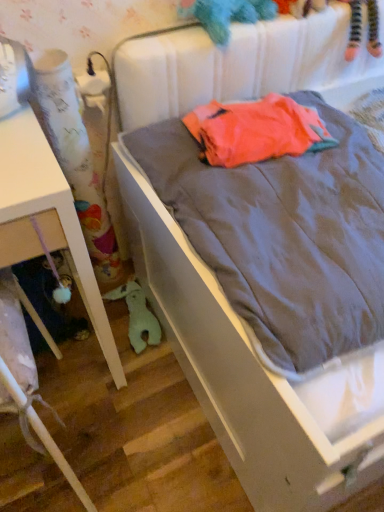
Question: From a real-world perspective, relative to white fabric curtain at left, is matte gray bed at center vertically above or below?

Choices:
 (A) above
 (B) below

Answer: (B)

Question: Considering the positions of point (172, 52) and point (46, 119), is point (172, 52) closer or farther from the camera than point (46, 119)?

Choices:
 (A) closer
 (B) farther

Answer: (A)

Question: Which object is the closest to the fluffy teal stuffed animal at upper center, the second toy when ordered from left to right?

Choices:
 (A) matte gray bed at center
 (B) green plush toy at lower left, which is the 2th toy from top to bottom
 (C) white matte table at left
 (D) white fabric curtain at left
 (E) neon orange fabric at center

Answer: (E)

Question: Which of these objects is positioned farthest from the white matte table at left?

Choices:
 (A) neon orange fabric at center
 (B) white fabric curtain at left
 (C) matte gray bed at center
 (D) fluffy teal stuffed animal at upper center, which is the 2th toy from bottom to top
 (E) green plush toy at lower left, which ranks as the 1th toy in back-to-front order

Answer: (D)